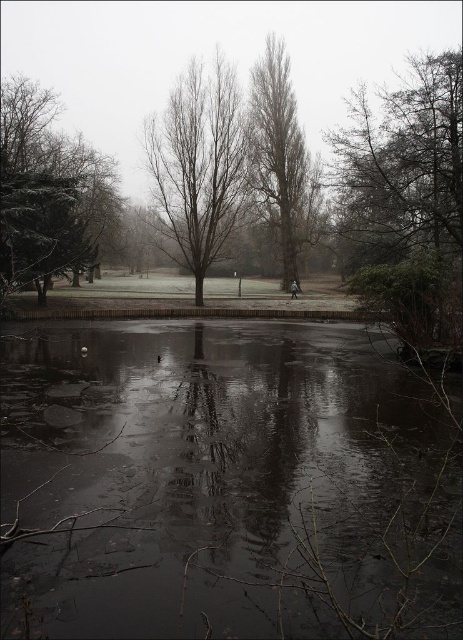
Question: From the image, what is the correct spatial relationship of dark glassy water at center in relation to snow-covered evergreen tree at left?

Choices:
 (A) right
 (B) left

Answer: (A)

Question: In this image, where is bare branches tree at center located relative to bare wood tree at center?

Choices:
 (A) left
 (B) right

Answer: (A)

Question: Estimate the real-world distances between objects in this image. Which object is farther from the snow-covered evergreen tree at left?

Choices:
 (A) dark glassy water at center
 (B) bare wood tree at center
 (C) bare branches tree at center

Answer: (A)

Question: Observing the image, what is the correct spatial positioning of dark glassy water at center in reference to bare branches tree at center?

Choices:
 (A) above
 (B) below

Answer: (B)

Question: Estimate the real-world distances between objects in this image. Which object is closer to the dark gray fabric jacket at center?

Choices:
 (A) snow-covered evergreen tree at left
 (B) smooth brown tree at right
 (C) dark glassy water at center

Answer: (A)

Question: Which point appears farthest from the camera in this image?

Choices:
 (A) (296, 294)
 (B) (314, 516)
 (C) (417, 304)

Answer: (A)